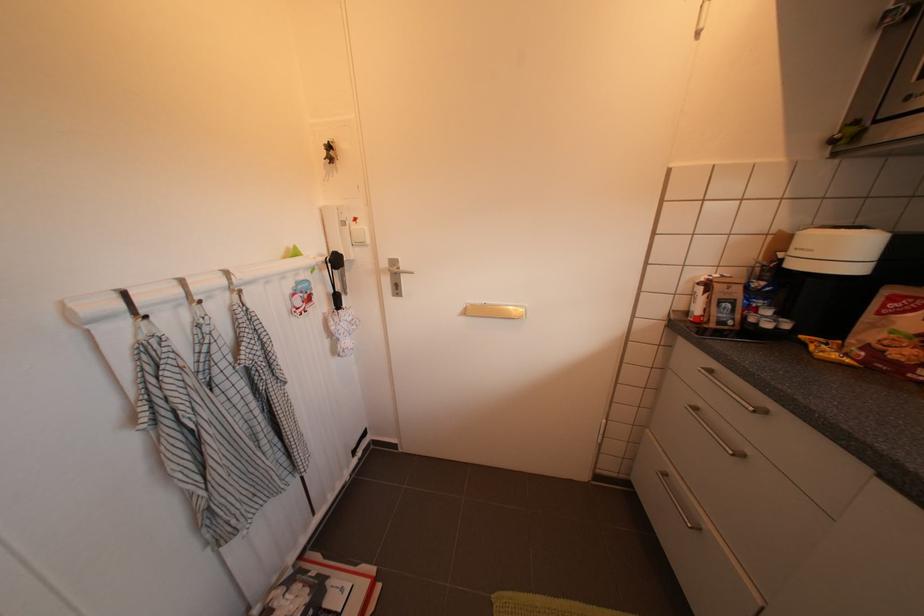
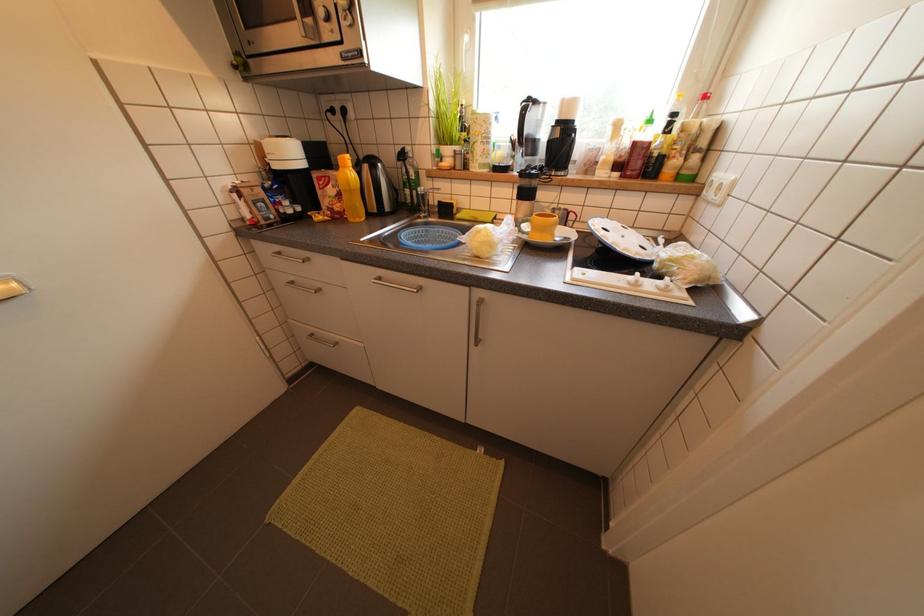
The first image is from the beginning of the video and the second image is from the end. How did the camera likely rotate when shooting the video?

The camera's rotation is toward right-down.